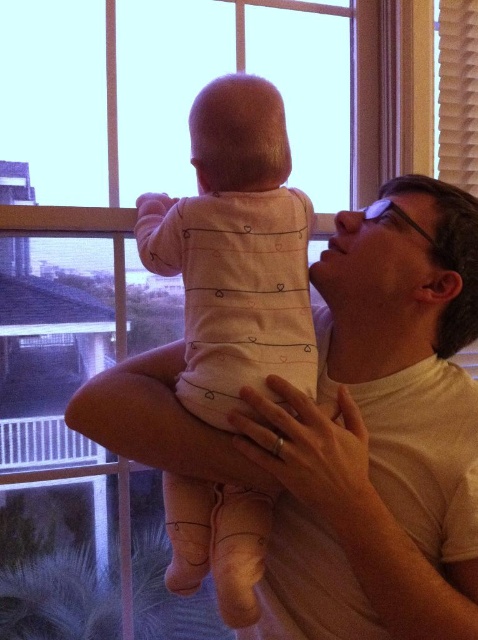
Between white matte arm at center and pink fabric baby at center, which one is positioned lower?

white matte arm at center is lower down.

Looking at this image, who is higher up, white matte arm at center or pink fabric baby at center?

pink fabric baby at center is higher up.

The height and width of the screenshot is (640, 478). What are the coordinates of `white matte arm at center` in the screenshot? It's located at click(371, 508).

Who is positioned more to the right, white matte shirt at upper center or white matte arm at center?

From the viewer's perspective, white matte arm at center appears more on the right side.

Can you confirm if white matte shirt at upper center is shorter than white matte arm at center?

No.

Image resolution: width=478 pixels, height=640 pixels. Describe the element at coordinates (347, 433) in the screenshot. I see `white matte shirt at upper center` at that location.

I want to click on white matte shirt at upper center, so click(x=347, y=433).

What do you see at coordinates (347, 433) in the screenshot? I see `white matte shirt at upper center` at bounding box center [347, 433].

This screenshot has width=478, height=640. What do you see at coordinates (347, 433) in the screenshot?
I see `white matte shirt at upper center` at bounding box center [347, 433].

Identify the location of white matte shirt at upper center. This screenshot has height=640, width=478. (347, 433).